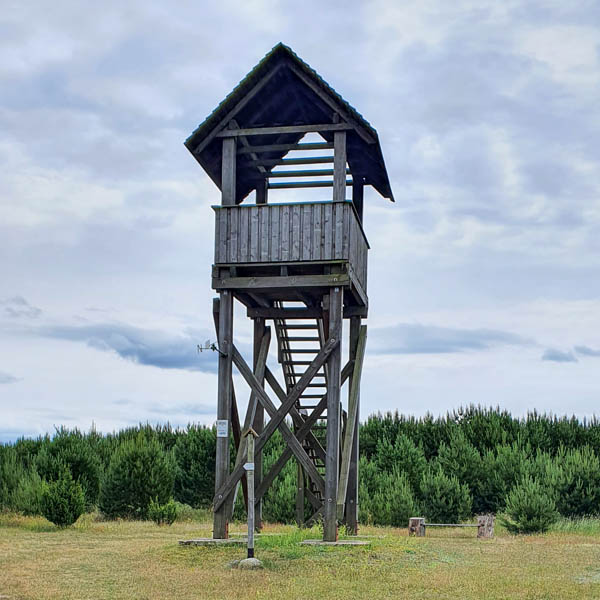
Locate an element on the screen. stairs is located at coordinates (295, 352).